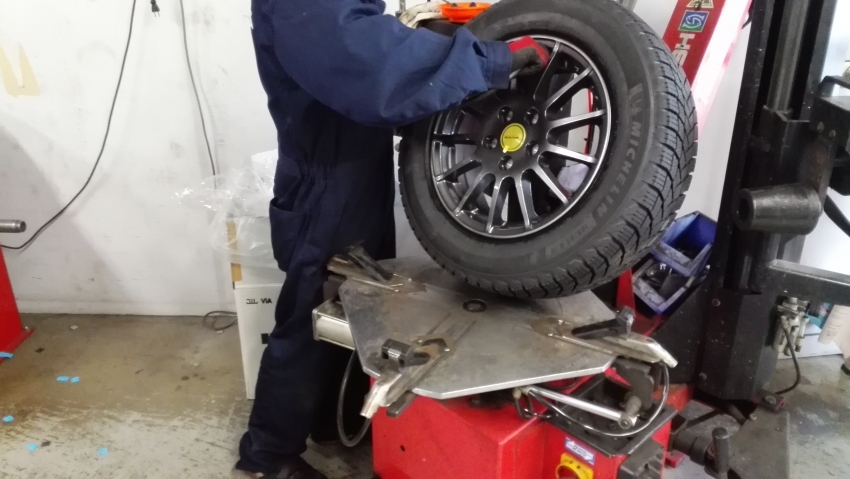
Identify the location of blue spots on floor. (104, 451), (31, 443), (6, 419), (3, 355), (61, 376), (77, 379).